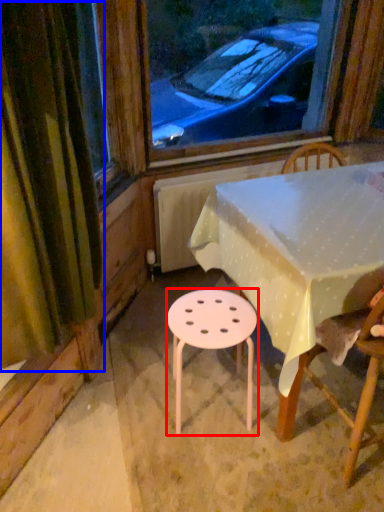
Question: Which object appears farthest to the camera in this image, stool (highlighted by a red box) or curtain (highlighted by a blue box)?

Choices:
 (A) stool
 (B) curtain

Answer: (A)